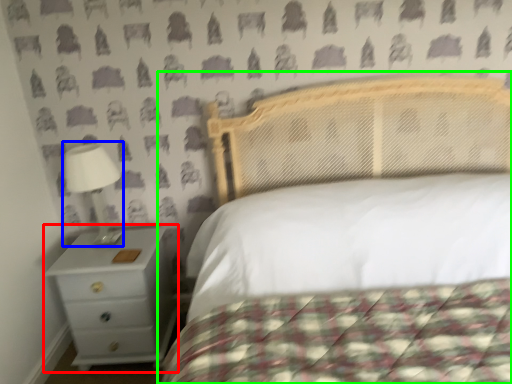
Question: Which object is the farthest from nightstand (highlighted by a red box)? Choose among these: lamp (highlighted by a blue box) or bed (highlighted by a green box).

Choices:
 (A) lamp
 (B) bed

Answer: (B)